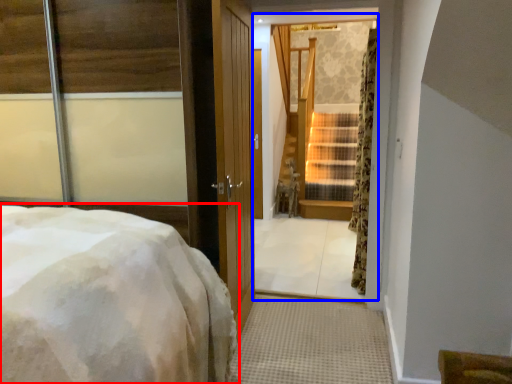
Question: Which object appears closest to the camera in this image, bed (highlighted by a red box) or window (highlighted by a blue box)?

Choices:
 (A) bed
 (B) window

Answer: (A)